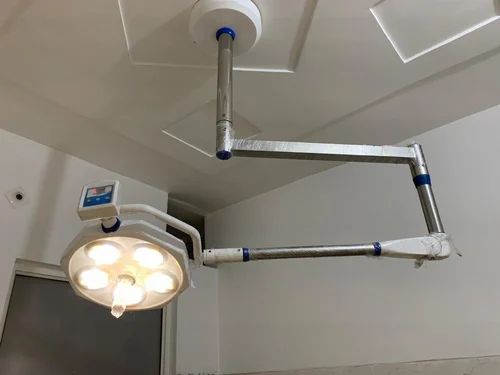
Identify the location of vent. click(198, 221).